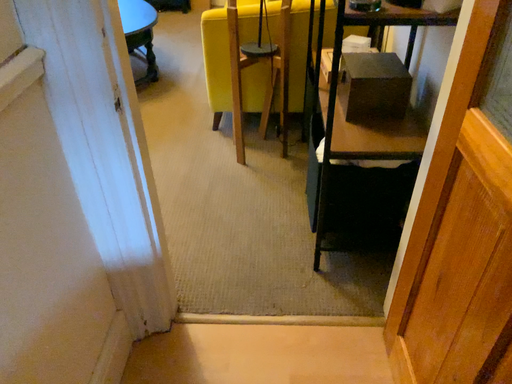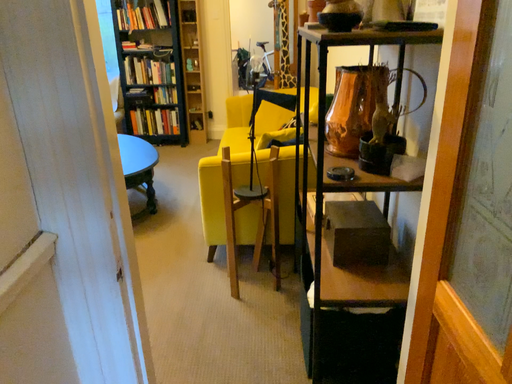
Question: Which way did the camera rotate in the video?

Choices:
 (A) rotated downward
 (B) rotated upward

Answer: (B)